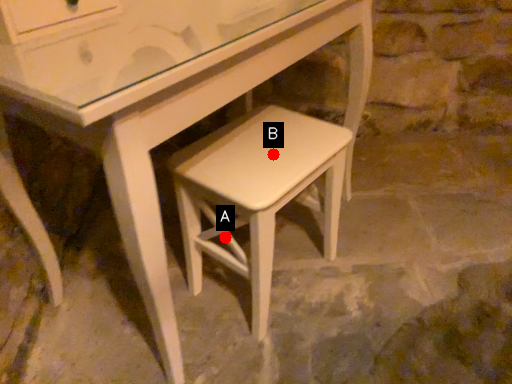
Question: Two points are circled on the image, labeled by A and B beside each circle. Which of the following is the closest to the observer?

Choices:
 (A) A is closer
 (B) B is closer

Answer: (B)